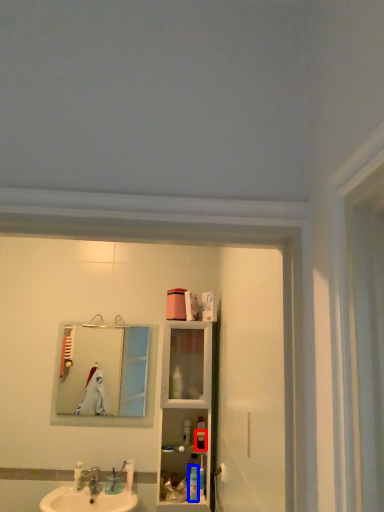
Question: Which object appears farthest to the camera in this image, toiletry (highlighted by a red box) or toiletry (highlighted by a blue box)?

Choices:
 (A) toiletry
 (B) toiletry

Answer: (A)